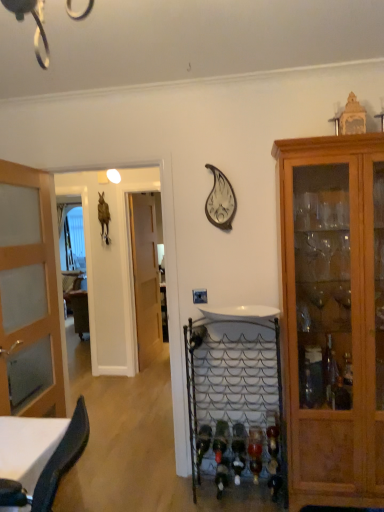
The height and width of the screenshot is (512, 384). What do you see at coordinates (235, 400) in the screenshot?
I see `metallic wire wine rack at center` at bounding box center [235, 400].

Describe the element at coordinates (333, 317) in the screenshot. The height and width of the screenshot is (512, 384). I see `wooden cabinet at right` at that location.

What do you see at coordinates (145, 277) in the screenshot? I see `wooden door at center, arranged as the first door when viewed from the back` at bounding box center [145, 277].

You are a GUI agent. You are given a task and a screenshot of the screen. Output one action in this format:
    pyautogui.click(x=<x>, y=<y>)
    Task: Click on the translucent glass wine bottle at lower center, the 2th wine bottle viewed from the left
    
    Given the screenshot: What is the action you would take?
    pyautogui.click(x=255, y=452)

Is metallic silver clock at upper center oriented towards wooden door at center, which appears as the 2th door when viewed from the front?

No, metallic silver clock at upper center does not turn towards wooden door at center, which appears as the 2th door when viewed from the front.

Which object is thinner, metallic silver clock at upper center or wooden door at center, marked as the 1th door in a right-to-left arrangement?

wooden door at center, marked as the 1th door in a right-to-left arrangement.

Find the location of a particular element. The image size is (384, 512). wine bottle on the left of metallic wire wine rack at center is located at coordinates (220, 440).

From the image's perspective, is green glass wine bottle at lower center, placed as the 2th wine bottle when sorted from bottom to top, above or below metallic wire wine rack at center?

From the image's perspective, green glass wine bottle at lower center, placed as the 2th wine bottle when sorted from bottom to top, appears below metallic wire wine rack at center.

How different are the orientations of green glass wine bottle at lower center, placed as the 2th wine bottle when sorted from bottom to top, and metallic wire wine rack at center in degrees?

0.283 degrees separate the facing orientations of green glass wine bottle at lower center, placed as the 2th wine bottle when sorted from bottom to top, and metallic wire wine rack at center.

Does green glass wine bottle at lower center, which is counted as the second wine bottle, starting from the right, turn towards metallic wire wine rack at center?

Yes.

Which object is closer to the camera, wooden door at center, arranged as the first door when viewed from the back, or green glass wine bottle at lower center, placed as the 2th wine bottle when sorted from bottom to top?

green glass wine bottle at lower center, placed as the 2th wine bottle when sorted from bottom to top.

From the picture: Is wooden door at center, arranged as the first door when viewed from the back, oriented away from green glass wine bottle at lower center, acting as the first wine bottle starting from the left?

No, wooden door at center, arranged as the first door when viewed from the back, is not facing the opposite direction of green glass wine bottle at lower center, acting as the first wine bottle starting from the left.

Does wooden door at center, marked as the 1th door in a right-to-left arrangement, touch green glass wine bottle at lower center, acting as the first wine bottle starting from the left?

No, wooden door at center, marked as the 1th door in a right-to-left arrangement, is not making contact with green glass wine bottle at lower center, acting as the first wine bottle starting from the left.

Is point (140, 357) closer or farther from the camera than point (215, 459)?

Point (140, 357) appears to be farther away from the viewer than point (215, 459).

From a real-world perspective, is green glass wine bottle at lower center, acting as the first wine bottle starting from the left, positioned above or below wooden cabinet at right?

green glass wine bottle at lower center, acting as the first wine bottle starting from the left, is below wooden cabinet at right.

Considering their positions, is green glass wine bottle at lower center, placed as the 2th wine bottle when sorted from bottom to top, located in front of or behind wooden cabinet at right?

green glass wine bottle at lower center, placed as the 2th wine bottle when sorted from bottom to top, is behind wooden cabinet at right.

Can you tell me how much green glass wine bottle at lower center, which is counted as the first wine bottle, starting from the top, and wooden cabinet at right differ in facing direction?

There is a 0.58-degree angle between the facing directions of green glass wine bottle at lower center, which is counted as the first wine bottle, starting from the top, and wooden cabinet at right.

Where is `cabinetry above the green glass wine bottle at lower center, which is counted as the second wine bottle, starting from the right (from a real-world perspective)`? Image resolution: width=384 pixels, height=512 pixels. cabinetry above the green glass wine bottle at lower center, which is counted as the second wine bottle, starting from the right (from a real-world perspective) is located at coordinates (333, 317).

Which of these two, green glass wine bottle at lower center, placed as the 2th wine bottle when sorted from bottom to top, or wooden door at center, which appears as the 2th door when viewed from the front, stands taller?

wooden door at center, which appears as the 2th door when viewed from the front.

Considering the sizes of green glass wine bottle at lower center, which is counted as the second wine bottle, starting from the right, and wooden door at center, arranged as the first door when viewed from the back, in the image, is green glass wine bottle at lower center, which is counted as the second wine bottle, starting from the right, wider or thinner than wooden door at center, arranged as the first door when viewed from the back,?

Considering their sizes, green glass wine bottle at lower center, which is counted as the second wine bottle, starting from the right, looks broader than wooden door at center, arranged as the first door when viewed from the back.

Is green glass wine bottle at lower center, acting as the first wine bottle starting from the left, not inside wooden door at center, which is counted as the second door, starting from the left?

green glass wine bottle at lower center, acting as the first wine bottle starting from the left, is positioned outside wooden door at center, which is counted as the second door, starting from the left.

How many degrees apart are the facing directions of wooden cabinet at right and translucent glass wine bottle at lower center, which appears as the 2th wine bottle when viewed from the top?

1.77 degrees separate the facing orientations of wooden cabinet at right and translucent glass wine bottle at lower center, which appears as the 2th wine bottle when viewed from the top.

From the image's perspective, between wooden cabinet at right and translucent glass wine bottle at lower center, the 2th wine bottle viewed from the left, which one is located above?

wooden cabinet at right.

Between wooden cabinet at right and translucent glass wine bottle at lower center, which appears as the 2th wine bottle when viewed from the top, which one is positioned behind?

translucent glass wine bottle at lower center, which appears as the 2th wine bottle when viewed from the top, is more distant.

Looking at their sizes, would you say wooden cabinet at right is wider or thinner than translucent glass wine bottle at lower center, which appears as the 2th wine bottle when viewed from the top?

Considering their sizes, wooden cabinet at right looks broader than translucent glass wine bottle at lower center, which appears as the 2th wine bottle when viewed from the top.

From the image's perspective, would you say wooden door at center, which is counted as the second door, starting from the left, is shown under metallic wire wine rack at center?

No, from the image's perspective, wooden door at center, which is counted as the second door, starting from the left, is not below metallic wire wine rack at center.

How much distance is there between wooden door at center, which appears as the 2th door when viewed from the front, and metallic wire wine rack at center?

wooden door at center, which appears as the 2th door when viewed from the front, is 2.28 meters away from metallic wire wine rack at center.

Is metallic wire wine rack at center inside wooden door at center, which is counted as the second door, starting from the left?

No, metallic wire wine rack at center is located outside of wooden door at center, which is counted as the second door, starting from the left.

There is a metallic silver clock at upper center. At what (x,y) coordinates should I click in order to perform the action: click on the 1st door below it (from the image's perspective). Please return your answer as a coordinate pair (x, y). Looking at the image, I should click on (145, 277).

Find the location of a particular element. Image resolution: width=384 pixels, height=512 pixels. wine rack above the green glass wine bottle at lower center, placed as the 2th wine bottle when sorted from bottom to top (from the image's perspective) is located at coordinates (235, 400).

When comparing their distances from metallic wire wine rack at center, does wooden cabinet at right or wooden door at center, which appears as the 2th door when viewed from the front, seem further?

Among the two, wooden door at center, which appears as the 2th door when viewed from the front, is located further to metallic wire wine rack at center.

When comparing their distances from wooden door at center, which appears as the 2th door when viewed from the front, does translucent wood door at left, which is the first door from left to right, or wooden cabinet at right seem further?

wooden cabinet at right is positioned further to the anchor wooden door at center, which appears as the 2th door when viewed from the front.

Looking at the image, which one is located further to wooden cabinet at right, metallic wire wine rack at center or green glass wine bottle at lower center, placed as the 2th wine bottle when sorted from bottom to top?

green glass wine bottle at lower center, placed as the 2th wine bottle when sorted from bottom to top, is further to wooden cabinet at right.

From the image, which object appears to be farther from translucent glass wine bottle at lower center, placed as the 1th wine bottle when sorted from bottom to top, translucent wood door at left, which is the first door from left to right, or green glass wine bottle at lower center, which is counted as the second wine bottle, starting from the right?

translucent wood door at left, which is the first door from left to right, lies further to translucent glass wine bottle at lower center, placed as the 1th wine bottle when sorted from bottom to top, than the other object.

Looking at the image, which one is located closer to metallic silver clock at upper center, wooden cabinet at right or metallic wire wine rack at center?

wooden cabinet at right lies closer to metallic silver clock at upper center than the other object.

Based on their spatial positions, is translucent glass wine bottle at lower center, which appears as the 2th wine bottle when viewed from the top, or metallic wire wine rack at center further from wooden cabinet at right?

translucent glass wine bottle at lower center, which appears as the 2th wine bottle when viewed from the top, lies further to wooden cabinet at right than the other object.

Looking at the image, which one is located closer to metallic silver clock at upper center, translucent glass wine bottle at lower center, which appears as the 2th wine bottle when viewed from the top, or wooden door at center, which appears as the 2th door when viewed from the front?

translucent glass wine bottle at lower center, which appears as the 2th wine bottle when viewed from the top, is positioned closer to the anchor metallic silver clock at upper center.

Based on their spatial positions, is metallic silver clock at upper center or green glass wine bottle at lower center, which is counted as the first wine bottle, starting from the top, closer to wooden door at center, which appears as the 2th door when viewed from the front?

green glass wine bottle at lower center, which is counted as the first wine bottle, starting from the top, lies closer to wooden door at center, which appears as the 2th door when viewed from the front, than the other object.

The height and width of the screenshot is (512, 384). What are the coordinates of `wine rack between metallic silver clock at upper center and translucent glass wine bottle at lower center, which appears as the 2th wine bottle when viewed from the top, from top to bottom` in the screenshot? It's located at (235, 400).

The image size is (384, 512). Identify the location of wine bottle between metallic wire wine rack at center and translucent glass wine bottle at lower center, the 2th wine bottle viewed from the left, in the up-down direction. (220, 440).

Locate an element on the screen. clock positioned between translucent glass wine bottle at lower center, which is the 1th wine bottle in right-to-left order, and wooden door at center, marked as the 1th door in a right-to-left arrangement, from near to far is located at coordinates (220, 201).

Find the location of a particular element. wine bottle between metallic wire wine rack at center and wooden door at center, marked as the 1th door in a right-to-left arrangement, in the front-back direction is located at coordinates (220, 440).